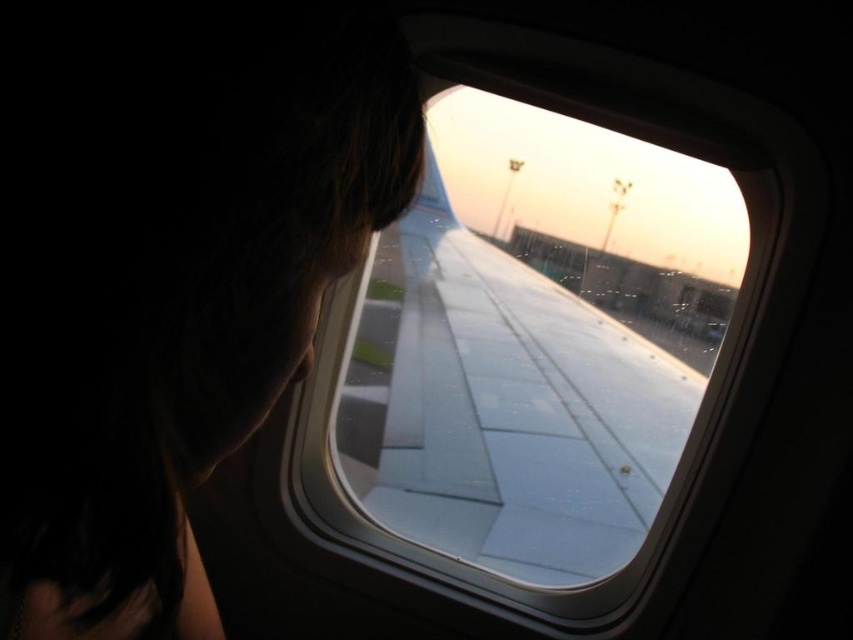
Question: Which object is farther from the camera taking this photo?

Choices:
 (A) dark hair at left
 (B) transparent glass wing at center

Answer: (B)

Question: Which of the following is the closest to the observer?

Choices:
 (A) transparent glass wing at center
 (B) dark hair at left

Answer: (B)

Question: Which point appears farthest from the camera in this image?

Choices:
 (A) (581, 515)
 (B) (49, 314)

Answer: (A)

Question: Does dark hair at left have a smaller size compared to transparent glass wing at center?

Choices:
 (A) no
 (B) yes

Answer: (B)

Question: Does dark hair at left come in front of transparent glass wing at center?

Choices:
 (A) yes
 (B) no

Answer: (A)

Question: Is the position of dark hair at left less distant than that of transparent glass wing at center?

Choices:
 (A) no
 (B) yes

Answer: (B)